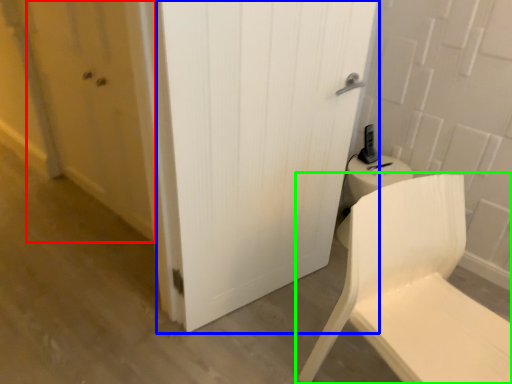
Question: Based on their relative distances, which object is farther from screen door (highlighted by a red box)? Choose from door (highlighted by a blue box) and chair (highlighted by a green box).

Choices:
 (A) door
 (B) chair

Answer: (B)